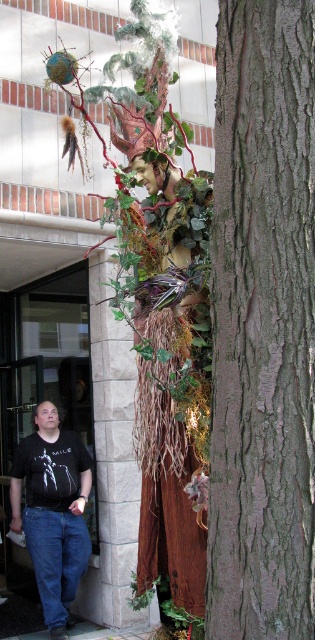
You are an artist planning to place a decorative item between the brown rough bark at right and the wooden statue at center. Considering their widths, which object should you choose to ensure it fits without exceeding the available space?

Result: The brown rough bark at right has a smaller width compared to the wooden statue at center. Therefore, you should choose an item that matches the narrower space next to the brown rough bark at right.